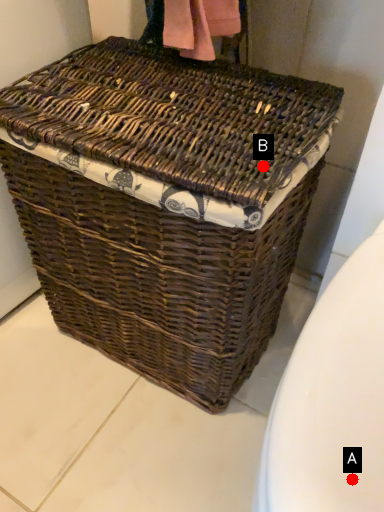
Question: Two points are circled on the image, labeled by A and B beside each circle. Which point appears closest to the camera in this image?

Choices:
 (A) A is closer
 (B) B is closer

Answer: (A)